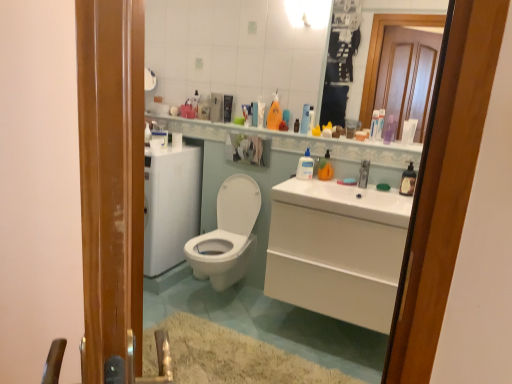
Find the location of `vacant area that lies between translucent plastic bottle at right, which appears as the 1th cleaning product when viewed from the front, and white glossy sink at upper center, placed as the first sink when sorted from right to left`. vacant area that lies between translucent plastic bottle at right, which appears as the 1th cleaning product when viewed from the front, and white glossy sink at upper center, placed as the first sink when sorted from right to left is located at coordinates (384, 192).